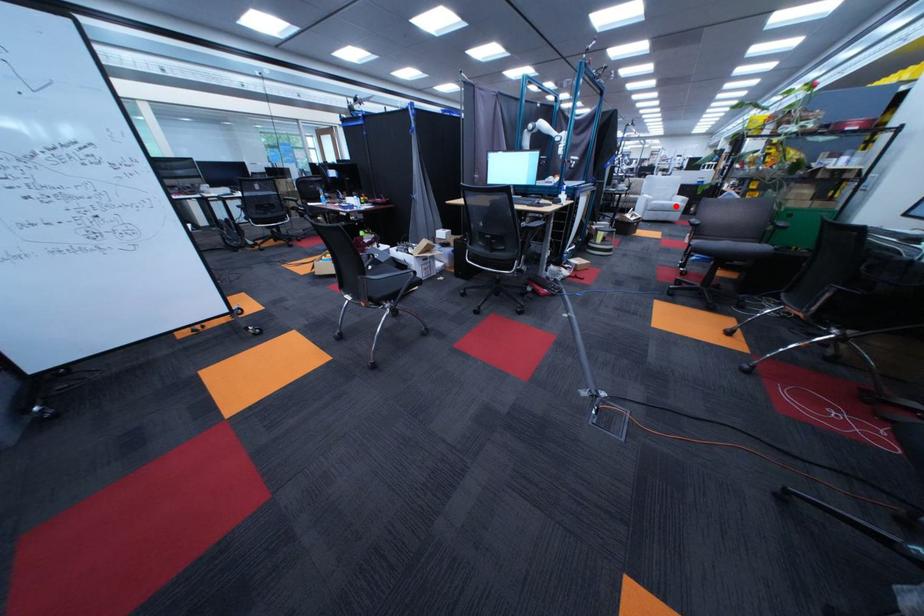
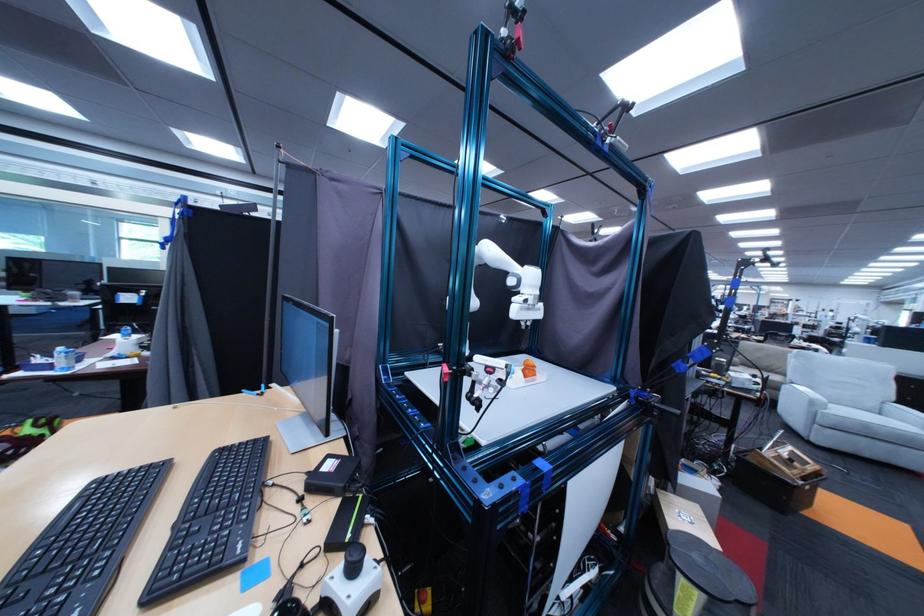
Find the pixel in the second image that matches the highlighted location in the first image.

(879, 426)